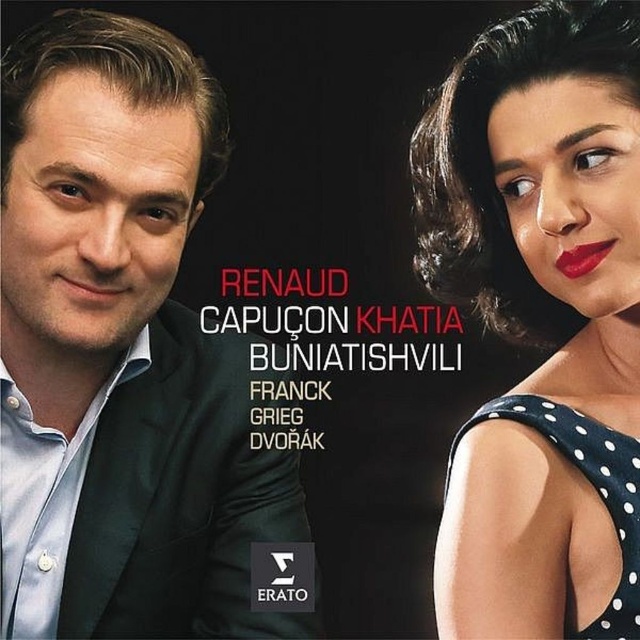
Is blue shirt at left smaller than black polka dot dress at upper right?

No, blue shirt at left is not smaller than black polka dot dress at upper right.

Who is shorter, blue shirt at left or black polka dot dress at upper right?

Standing shorter between the two is black polka dot dress at upper right.

Between point (108, 70) and point (566, 392), which one is positioned in front?

Point (108, 70) is in front.

Find the location of `blue shirt at left`. blue shirt at left is located at coordinates (122, 353).

This screenshot has width=640, height=640. Identify the location of blue shirt at left. (122, 353).

Is point (52, 625) positioned in front of point (589, 264)?

No.

The image size is (640, 640). Identify the location of blue shirt at left. (122, 353).

Is black polka dot dress at upper right wider than matte red lipstick at upper right?

Correct, the width of black polka dot dress at upper right exceeds that of matte red lipstick at upper right.

Does black polka dot dress at upper right have a larger size compared to matte red lipstick at upper right?

Correct, black polka dot dress at upper right is larger in size than matte red lipstick at upper right.

Locate an element on the screen. This screenshot has height=640, width=640. black polka dot dress at upper right is located at coordinates (540, 321).